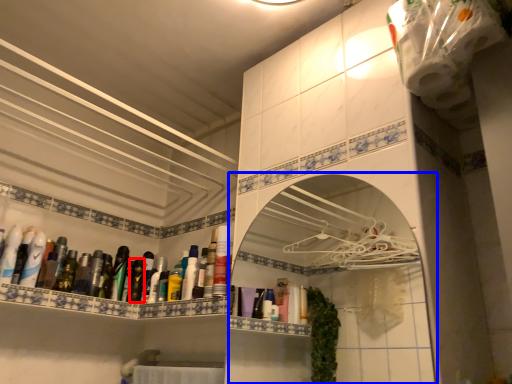
Question: Which object is closer to the camera taking this photo, mouthwash (highlighted by a red box) or medicine cabinet (highlighted by a blue box)?

Choices:
 (A) mouthwash
 (B) medicine cabinet

Answer: (B)